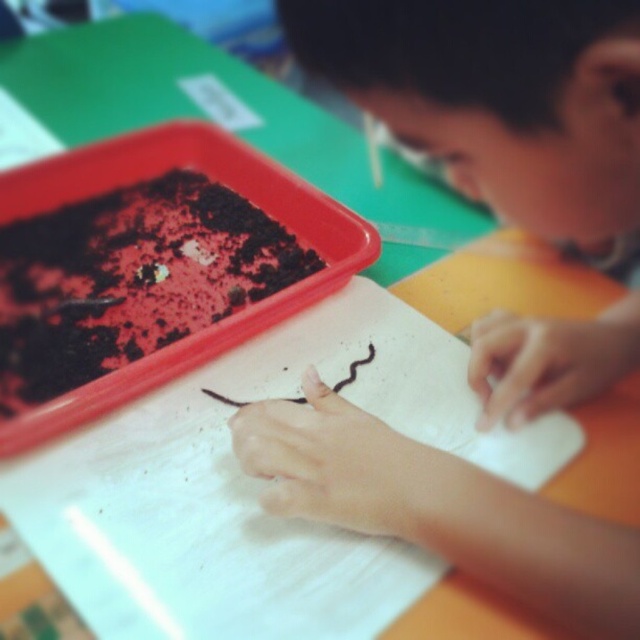
Who is taller, smooth skin boy at center or chocolate cake at center?

smooth skin boy at center

Is smooth skin boy at center below chocolate cake at center?

Yes, smooth skin boy at center is below chocolate cake at center.

Is point (385, 33) positioned before point (29, 342)?

Yes, point (385, 33) is in front of point (29, 342).

The image size is (640, 640). Find the location of `smooth skin boy at center`. smooth skin boy at center is located at coordinates (499, 99).